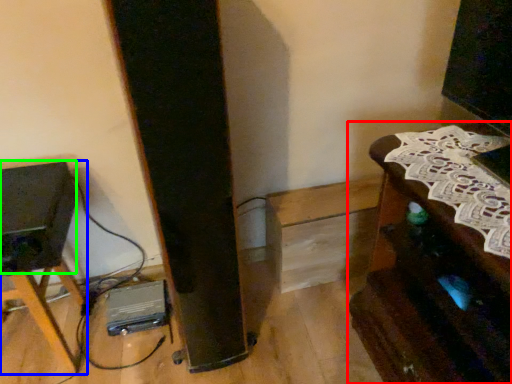
Question: Considering the real-world distances, which object is closest to furniture (highlighted by a red box)? furniture (highlighted by a blue box) or speaker (highlighted by a green box).

Choices:
 (A) furniture
 (B) speaker

Answer: (B)